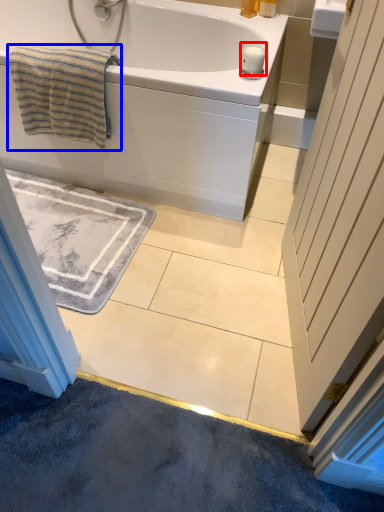
Question: Which point is closer to the camera, candle (highlighted by a red box) or beach towel (highlighted by a blue box)?

Choices:
 (A) candle
 (B) beach towel

Answer: (B)